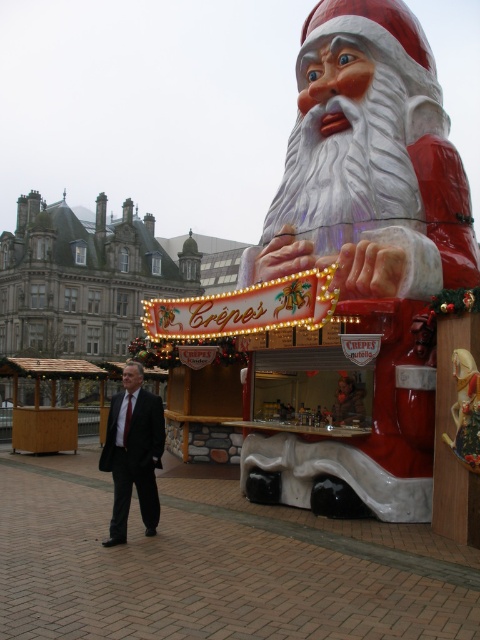
Looking at this image, is matte plastic santa at center behind dark suit at center?

Yes, matte plastic santa at center is behind dark suit at center.

Is point (381, 52) positioned in front of point (119, 474)?

No.

In order to click on matte plastic santa at center in this screenshot , I will do `click(359, 268)`.